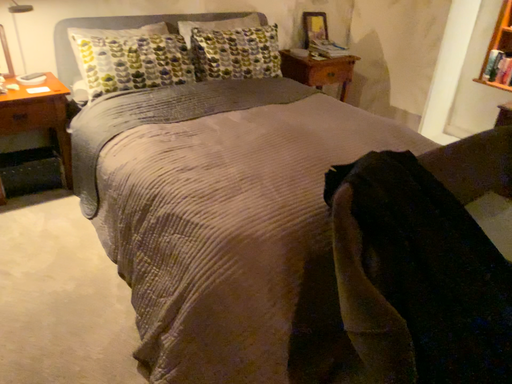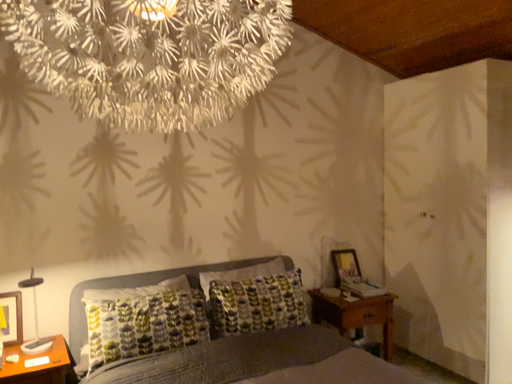
Question: How did the camera likely rotate when shooting the video?

Choices:
 (A) rotated downward
 (B) rotated upward

Answer: (B)